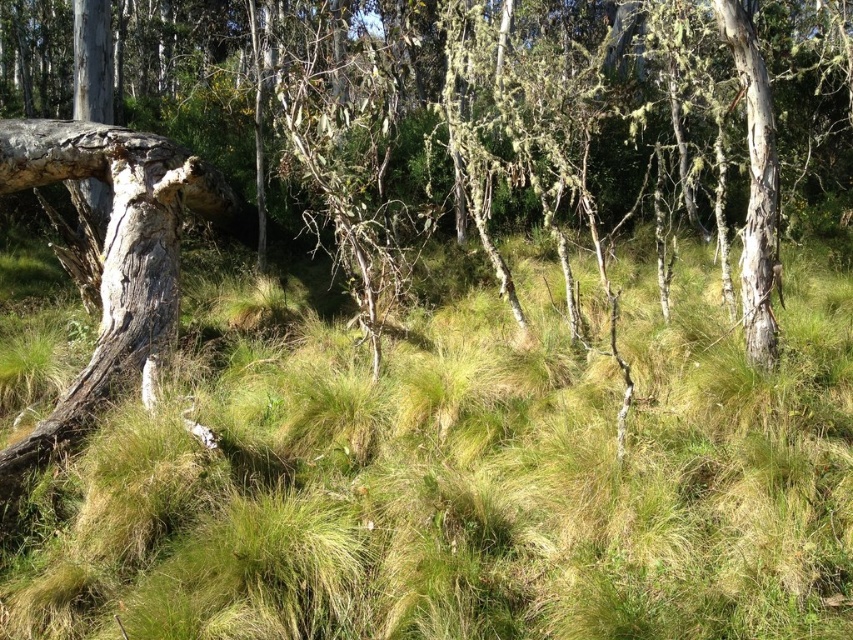
Can you confirm if green grassy at center is wider than smooth bark tree trunk at right?

Yes.

Is point (347, 490) more distant than point (764, 250)?

No, it is in front of (764, 250).

At what (x,y) coordinates should I click in order to perform the action: click on green grassy at center. Please return your answer as a coordinate pair (x, y). Looking at the image, I should click on (460, 476).